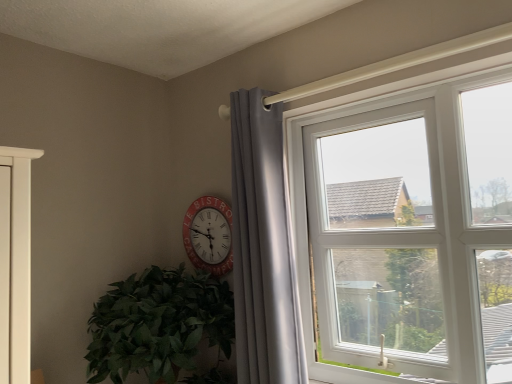
Find the location of a particular element. green leafy plant at lower left is located at coordinates (161, 327).

Image resolution: width=512 pixels, height=384 pixels. Describe the element at coordinates (161, 327) in the screenshot. I see `green leafy plant at lower left` at that location.

Find the location of a particular element. Image resolution: width=512 pixels, height=384 pixels. matte gray curtain at upper right is located at coordinates tap(262, 247).

This screenshot has width=512, height=384. I want to click on white plastic window at upper right, so click(408, 230).

Can you confirm if red plastic clock at center is positioned to the right of green leafy plant at lower left?

Indeed, red plastic clock at center is positioned on the right side of green leafy plant at lower left.

Would you say red plastic clock at center is inside or outside green leafy plant at lower left?

red plastic clock at center is outside green leafy plant at lower left.

Is the surface of red plastic clock at center in direct contact with green leafy plant at lower left?

No, red plastic clock at center is not touching green leafy plant at lower left.

Between matte gray curtain at upper right and green leafy plant at lower left, which one has smaller size?

matte gray curtain at upper right is smaller.

From the picture: Could you tell me if matte gray curtain at upper right is facing green leafy plant at lower left?

No, matte gray curtain at upper right is not aimed at green leafy plant at lower left.

Is there a large distance between matte gray curtain at upper right and green leafy plant at lower left?

No, matte gray curtain at upper right is not far away from green leafy plant at lower left.

Which object is further away from the camera, matte gray curtain at upper right or green leafy plant at lower left?

matte gray curtain at upper right is more distant.

Is there a large distance between red plastic clock at center and white plastic window at upper right?

red plastic clock at center is near white plastic window at upper right, not far away.

In the scene shown: Is red plastic clock at center turned away from white plastic window at upper right?

No, red plastic clock at center's orientation is not away from white plastic window at upper right.

Can you confirm if red plastic clock at center is thinner than white plastic window at upper right?

Indeed, red plastic clock at center has a lesser width compared to white plastic window at upper right.

Looking at the image, does red plastic clock at center seem bigger or smaller compared to white plastic window at upper right?

In the image, red plastic clock at center appears to be smaller than white plastic window at upper right.

What are the coordinates of `curtain in front of the red plastic clock at center` in the screenshot? It's located at (262, 247).

From a real-world perspective, is matte gray curtain at upper right above or below red plastic clock at center?

In terms of real-world spatial position, matte gray curtain at upper right is below red plastic clock at center.

Which object is wider, matte gray curtain at upper right or red plastic clock at center?

With larger width is matte gray curtain at upper right.

Can you confirm if matte gray curtain at upper right is smaller than red plastic clock at center?

Actually, matte gray curtain at upper right might be larger than red plastic clock at center.

Does green leafy plant at lower left have a smaller size compared to red plastic clock at center?

No, green leafy plant at lower left is not smaller than red plastic clock at center.

In the scene shown: Which object is more forward, green leafy plant at lower left or red plastic clock at center?

green leafy plant at lower left is closer to the camera.

Image resolution: width=512 pixels, height=384 pixels. Identify the location of houseplant below the white plastic window at upper right (from the image's perspective). pos(161,327).

Which is more to the right, white plastic window at upper right or green leafy plant at lower left?

white plastic window at upper right is more to the right.

Based on the photo, considering the sizes of objects white plastic window at upper right and green leafy plant at lower left in the image provided, who is thinner, white plastic window at upper right or green leafy plant at lower left?

With smaller width is white plastic window at upper right.

Is white plastic window at upper right turned away from red plastic clock at center?

No.

From the image's perspective, which object appears higher, white plastic window at upper right or red plastic clock at center?

white plastic window at upper right, from the image's perspective.

Does white plastic window at upper right have a lesser height compared to red plastic clock at center?

In fact, white plastic window at upper right may be taller than red plastic clock at center.

Would you consider white plastic window at upper right to be distant from red plastic clock at center?

No, white plastic window at upper right is not far away from red plastic clock at center.

Where is `houseplant in front of the red plastic clock at center`? This screenshot has height=384, width=512. houseplant in front of the red plastic clock at center is located at coordinates (161, 327).

Locate an element on the screen. houseplant on the left of the matte gray curtain at upper right is located at coordinates (161, 327).

Estimate the real-world distances between objects in this image. Which object is closer to white plastic window at upper right, red plastic clock at center or matte gray curtain at upper right?

matte gray curtain at upper right lies closer to white plastic window at upper right than the other object.

When comparing their distances from green leafy plant at lower left, does white plastic window at upper right or matte gray curtain at upper right seem closer?

Among the two, matte gray curtain at upper right is located nearer to green leafy plant at lower left.

Considering their positions, is matte gray curtain at upper right positioned closer to red plastic clock at center than green leafy plant at lower left?

green leafy plant at lower left.

Considering their positions, is green leafy plant at lower left positioned further to matte gray curtain at upper right than white plastic window at upper right?

white plastic window at upper right is positioned further to the anchor matte gray curtain at upper right.

Estimate the real-world distances between objects in this image. Which object is closer to green leafy plant at lower left, matte gray curtain at upper right or white plastic window at upper right?

The object closer to green leafy plant at lower left is matte gray curtain at upper right.

From the image, which object appears to be nearer to green leafy plant at lower left, red plastic clock at center or matte gray curtain at upper right?

red plastic clock at center is closer to green leafy plant at lower left.

From the image, which object appears to be farther from matte gray curtain at upper right, white plastic window at upper right or green leafy plant at lower left?

white plastic window at upper right.

When comparing their distances from white plastic window at upper right, does green leafy plant at lower left or matte gray curtain at upper right seem further?

Based on the image, green leafy plant at lower left appears to be further to white plastic window at upper right.

Identify the location of curtain between red plastic clock at center and white plastic window at upper right. The width and height of the screenshot is (512, 384). click(262, 247).

Where is `curtain positioned between green leafy plant at lower left and red plastic clock at center from near to far`? This screenshot has height=384, width=512. curtain positioned between green leafy plant at lower left and red plastic clock at center from near to far is located at coordinates (262, 247).

Identify the location of wall clock located between green leafy plant at lower left and white plastic window at upper right in the left-right direction. This screenshot has width=512, height=384. (209, 235).

Find the location of a particular element. This screenshot has height=384, width=512. curtain situated between green leafy plant at lower left and white plastic window at upper right from left to right is located at coordinates (262, 247).